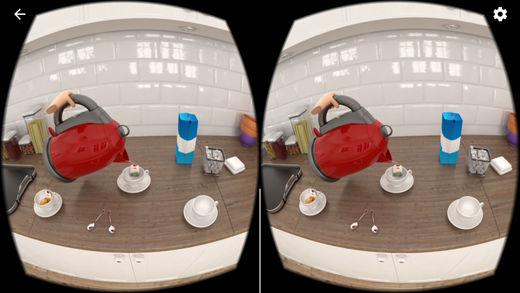
The image size is (520, 293). In order to click on cabinet handles in this screenshot , I will do `click(119, 258)`, `click(137, 258)`, `click(382, 255)`, `click(400, 258)`.